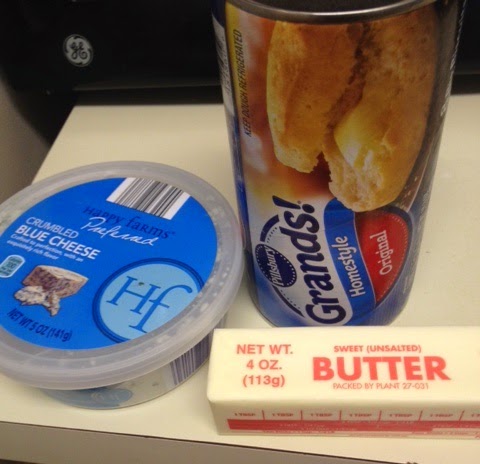
The image size is (480, 464). Identify the location of left wall. (5, 122), (16, 157).